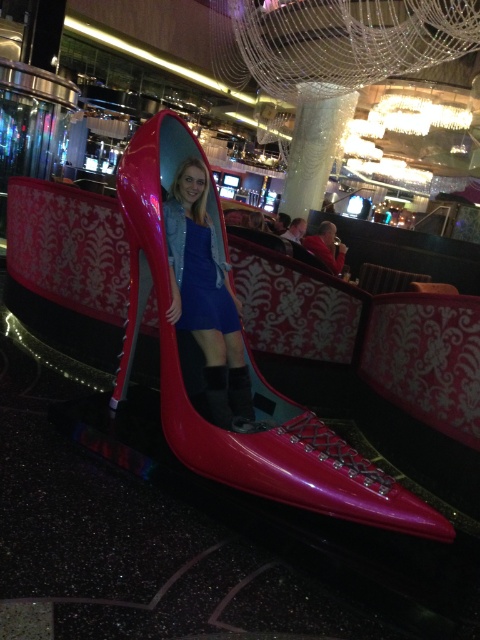
Question: Is matte blue dress at center below shiny patent leather shoe at center?

Choices:
 (A) yes
 (B) no

Answer: (B)

Question: Is matte blue dress at center positioned before shiny patent leather shoe at center?

Choices:
 (A) yes
 (B) no

Answer: (B)

Question: Which object appears farthest from the camera in this image?

Choices:
 (A) matte blue dress at center
 (B) shiny patent leather shoe at center

Answer: (A)

Question: Can you confirm if matte blue dress at center is positioned above shiny patent leather shoe at center?

Choices:
 (A) no
 (B) yes

Answer: (B)